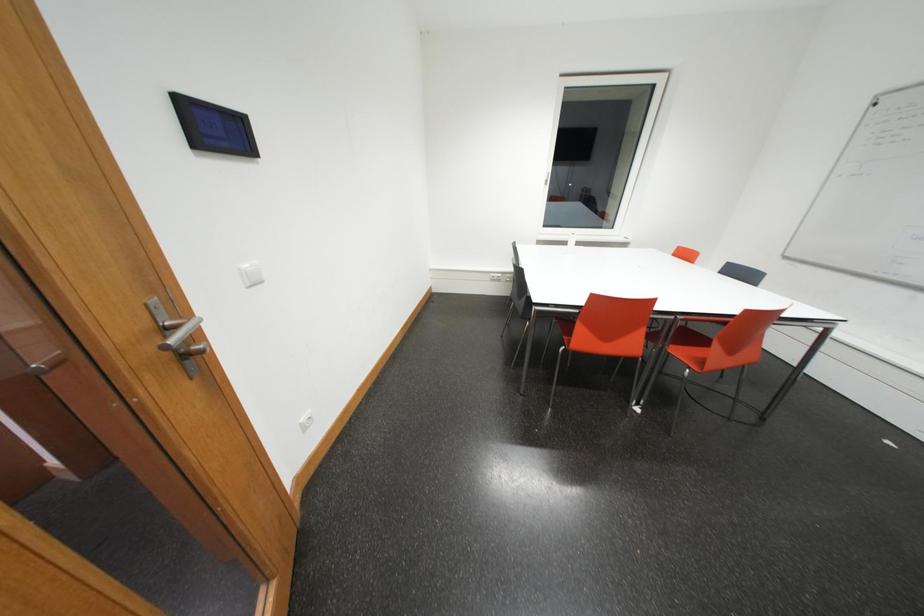
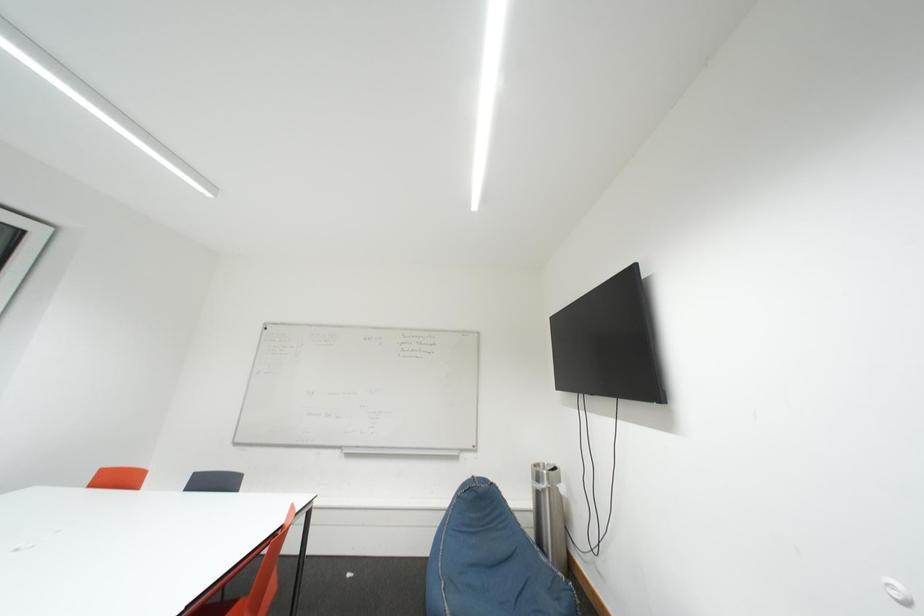
Question: The camera is either moving clockwise (left) or counter-clockwise (right) around the object. The first image is from the beginning of the video and the second image is from the end. Is the camera moving left or right when shooting the video?

Choices:
 (A) Left
 (B) Right

Answer: (A)